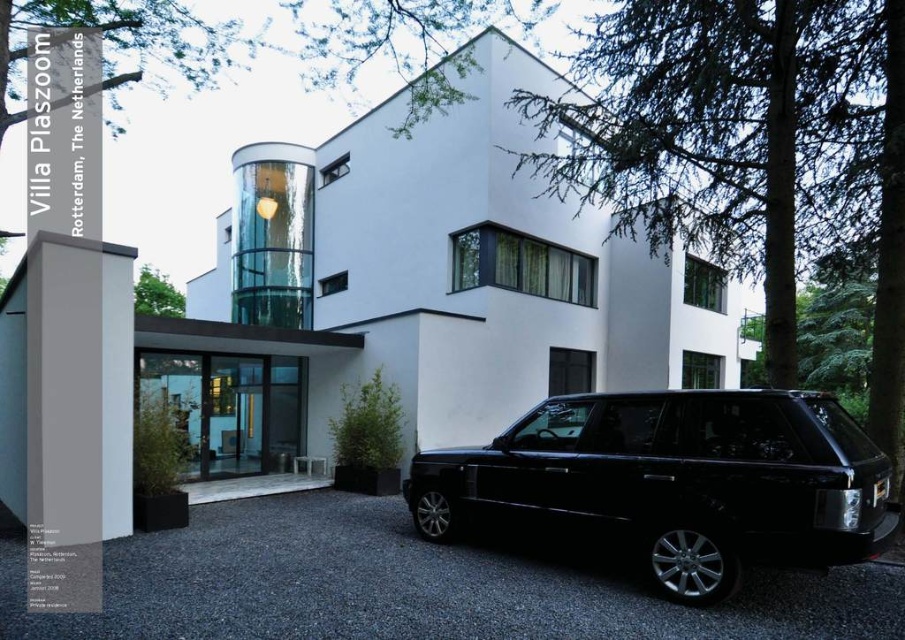
You are planning to park another car behind the black glossy suv at center. Based on the scene, is there enough space on the black asphalt driveway at lower center for another car?

The black asphalt driveway at lower center has a smaller size compared to the black glossy suv at center, so there might not be enough space to park another car behind it.

You are a delivery person approaching Villa Plaszoom and need to park your vehicle. The black glossy suv at center is already occupying the parking spot. Can you maneuver your car into the parking space next to it using the black asphalt driveway at lower center?

The black asphalt driveway at lower center is positioned on the left side of the black glossy suv at center. Since the driveway is on the left, you can drive along the driveway to the left of the suv and park next to it.